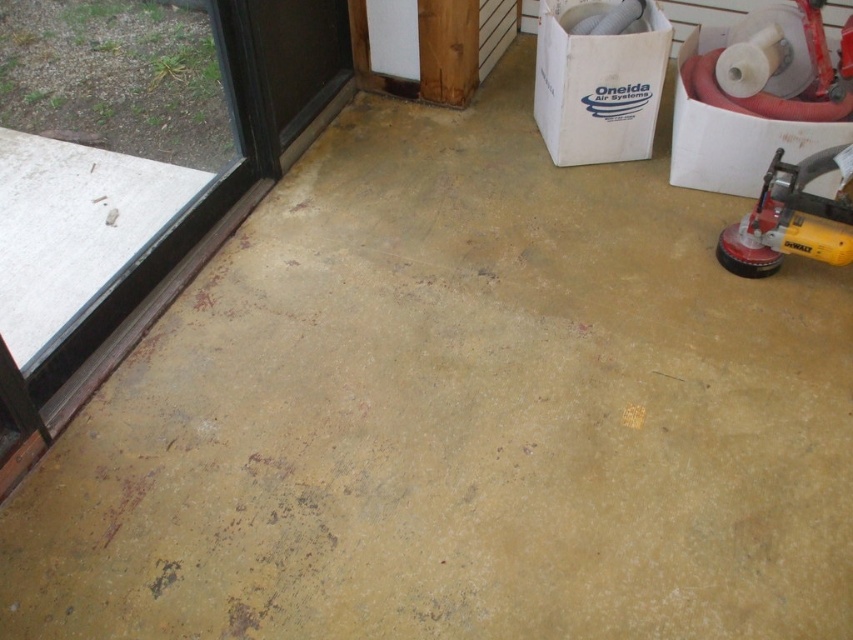
Does transparent glass door at left lie behind yellow plastic sander at right?

No, it is in front of yellow plastic sander at right.

Does transparent glass door at left appear on the right side of yellow plastic sander at right?

In fact, transparent glass door at left is to the left of yellow plastic sander at right.

What do you see at coordinates (97, 262) in the screenshot? I see `transparent glass door at left` at bounding box center [97, 262].

Where is `transparent glass door at left`? Image resolution: width=853 pixels, height=640 pixels. transparent glass door at left is located at coordinates (97, 262).